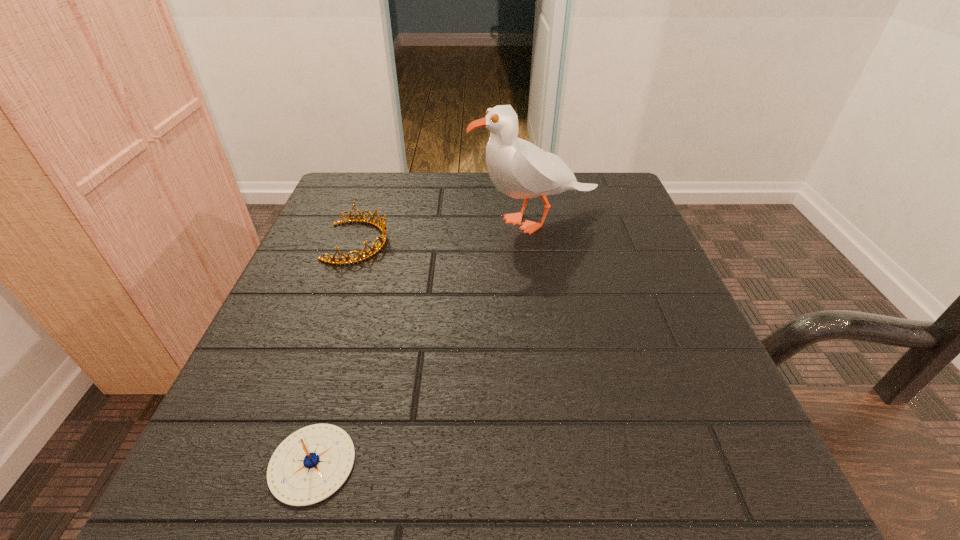
The width and height of the screenshot is (960, 540). In order to click on the tallest object in this screenshot , I will do `click(518, 168)`.

Find the location of a particular element. This screenshot has height=540, width=960. the rightmost object is located at coordinates (518, 168).

Where is `tiara`? This screenshot has width=960, height=540. tiara is located at coordinates (381, 226).

Locate an element on the screen. The width and height of the screenshot is (960, 540). compass is located at coordinates (312, 463).

You are a GUI agent. You are given a task and a screenshot of the screen. Output one action in this format:
    pyautogui.click(x=<x>, y=<y>)
    Task: Click on the shortest object
    
    Given the screenshot: What is the action you would take?
    pyautogui.click(x=312, y=463)

At what (x,y) coordinates should I click in order to perform the action: click on free location located 0.340m at the beak of the tallest object. Please return your answer as a coordinate pair (x, y). Image resolution: width=960 pixels, height=540 pixels. Looking at the image, I should click on (314, 221).

You are a GUI agent. You are given a task and a screenshot of the screen. Output one action in this format:
    pyautogui.click(x=<x>, y=<y>)
    Task: Click on the free space located 0.220m at the beak of the tallest object
    The image size is (960, 540).
    Given the screenshot: What is the action you would take?
    pyautogui.click(x=369, y=221)

Identify the location of free space located 0.060m at the beak of the tallest object. The image size is (960, 540). (442, 221).

This screenshot has height=540, width=960. Identify the location of blank space located on the front-facing side of the tiara. (502, 242).

Identify the location of free spot located on the right of the compass. (425, 463).